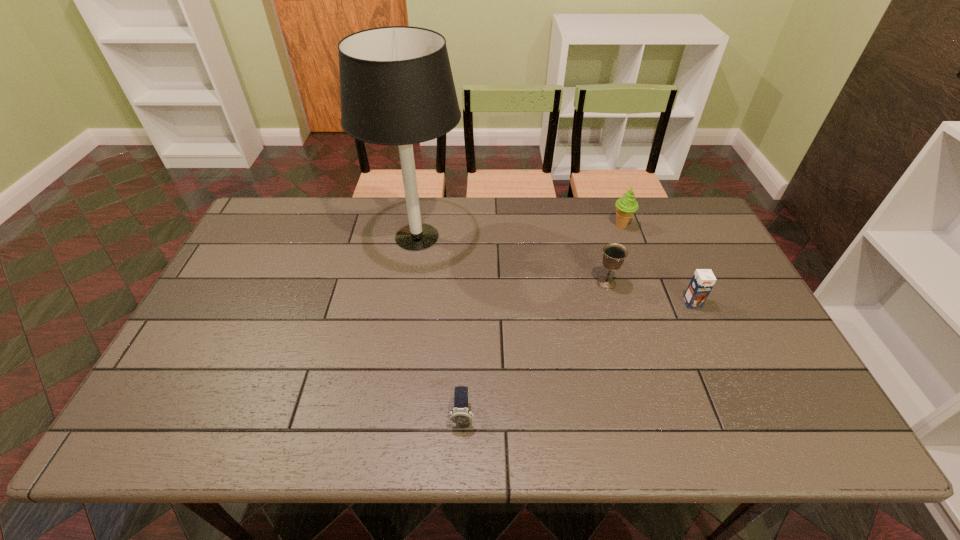
The image size is (960, 540). In the image, there is a desktop. Find the location of `vacant region at the right edge`. vacant region at the right edge is located at coordinates (698, 269).

Where is `vacant space at the far right corner of the desktop`? This screenshot has height=540, width=960. vacant space at the far right corner of the desktop is located at coordinates (711, 235).

The width and height of the screenshot is (960, 540). I want to click on free location at the near right corner, so click(x=800, y=429).

Image resolution: width=960 pixels, height=540 pixels. Find the location of `free space between the table lamp and the chalice`. free space between the table lamp and the chalice is located at coordinates (512, 260).

Where is `vacant area that lies between the fourth farthest object and the table lamp`? vacant area that lies between the fourth farthest object and the table lamp is located at coordinates (555, 270).

Find the location of `vacant point located between the shortest object and the third object from left to right`. vacant point located between the shortest object and the third object from left to right is located at coordinates (535, 349).

The image size is (960, 540). In order to click on unoccupied area between the chocolate milk and the shortest object in this screenshot , I will do `click(577, 359)`.

The height and width of the screenshot is (540, 960). Find the location of `free space between the shortest object and the chocolate milk`. free space between the shortest object and the chocolate milk is located at coordinates (577, 359).

The height and width of the screenshot is (540, 960). Identify the location of vacant area that lies between the chalice and the tallest object. (512, 260).

Image resolution: width=960 pixels, height=540 pixels. Identify the location of vacant point located between the table lamp and the chalice. (512, 260).